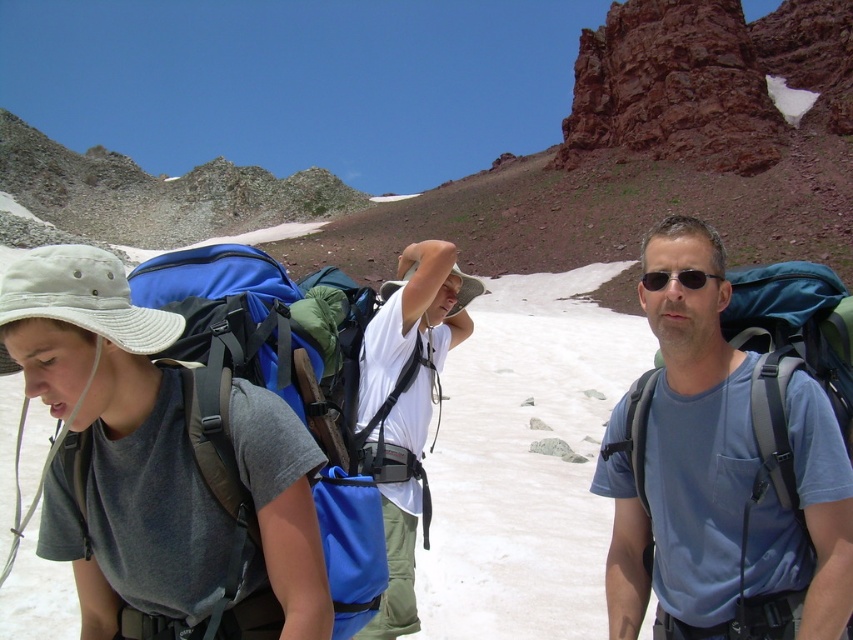
You are a hiker trying to locate your gear. You have a blue fabric backpack at left and a pair of black plastic sunglasses at center. Which item is positioned more to the left?

The blue fabric backpack at left is positioned more to the left than the black plastic sunglasses at center.